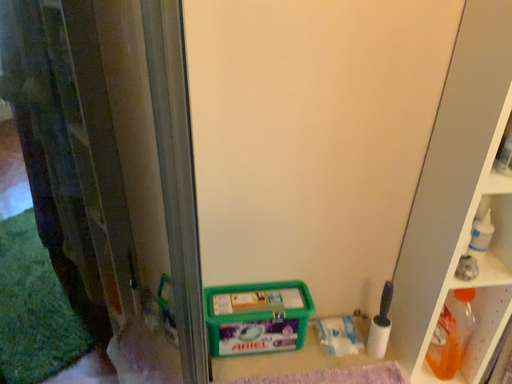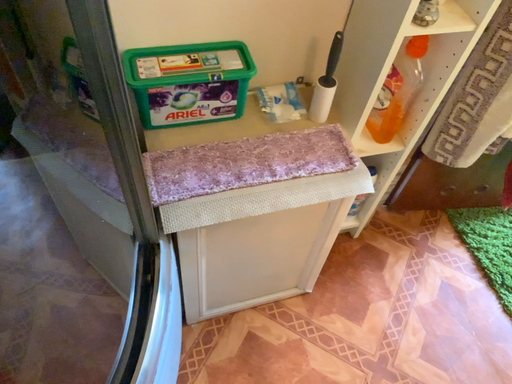
Question: How did the camera likely rotate when shooting the video?

Choices:
 (A) rotated right
 (B) rotated left

Answer: (A)